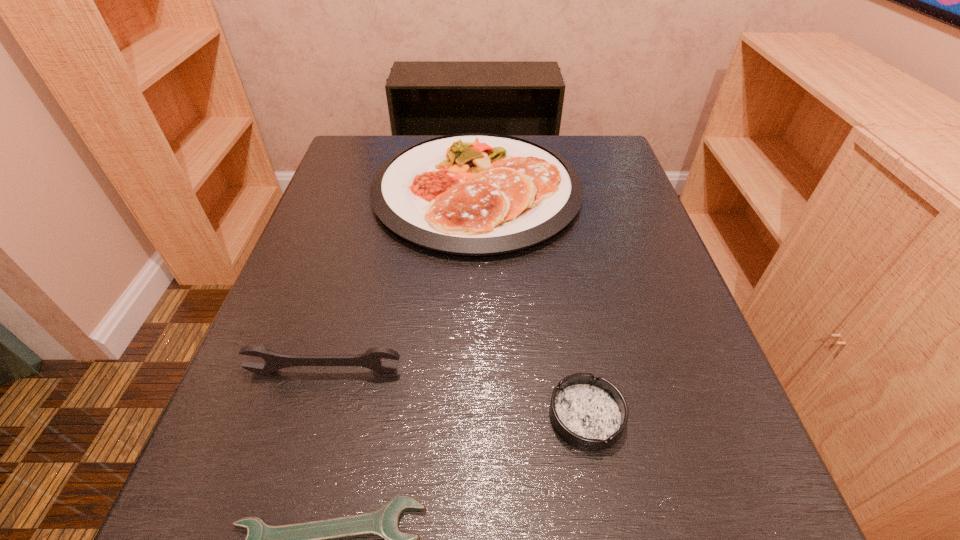
Find the location of a particular element. wrench that is positioned at the left edge is located at coordinates (370, 359).

The width and height of the screenshot is (960, 540). Identify the location of dish at the right edge. (475, 194).

The width and height of the screenshot is (960, 540). What are the coordinates of `ashtray that is positioned at the right edge` in the screenshot? It's located at (590, 413).

Locate an element on the screen. The image size is (960, 540). object present at the far left corner is located at coordinates (475, 194).

At what (x,y) coordinates should I click in order to perform the action: click on object located at the far right corner. Please return your answer as a coordinate pair (x, y). The width and height of the screenshot is (960, 540). Looking at the image, I should click on pyautogui.click(x=475, y=194).

This screenshot has width=960, height=540. What are the coordinates of `vacant space at the far edge of the desktop` in the screenshot? It's located at (547, 144).

The width and height of the screenshot is (960, 540). In the image, there is a desktop. Find the location of `vacant space at the near edge`. vacant space at the near edge is located at coordinates (514, 528).

You are a GUI agent. You are given a task and a screenshot of the screen. Output one action in this format:
    pyautogui.click(x=<x>, y=<y>)
    Task: Click on the vacant space at the left edge
    
    Given the screenshot: What is the action you would take?
    pyautogui.click(x=301, y=278)

Locate an element on the screen. The width and height of the screenshot is (960, 540). vacant point at the right edge is located at coordinates (619, 273).

Where is `free region at the far left corner of the desktop`? This screenshot has height=540, width=960. free region at the far left corner of the desktop is located at coordinates (359, 141).